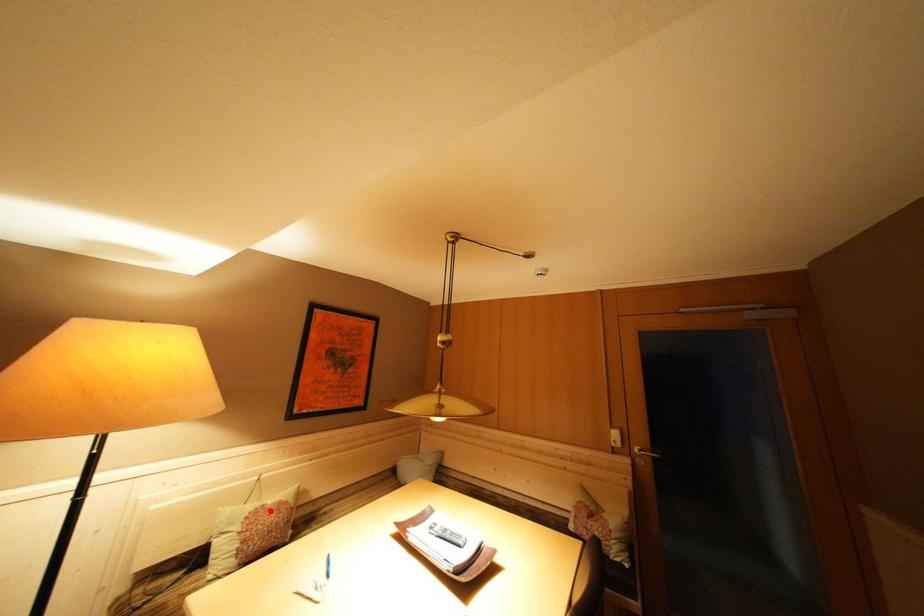
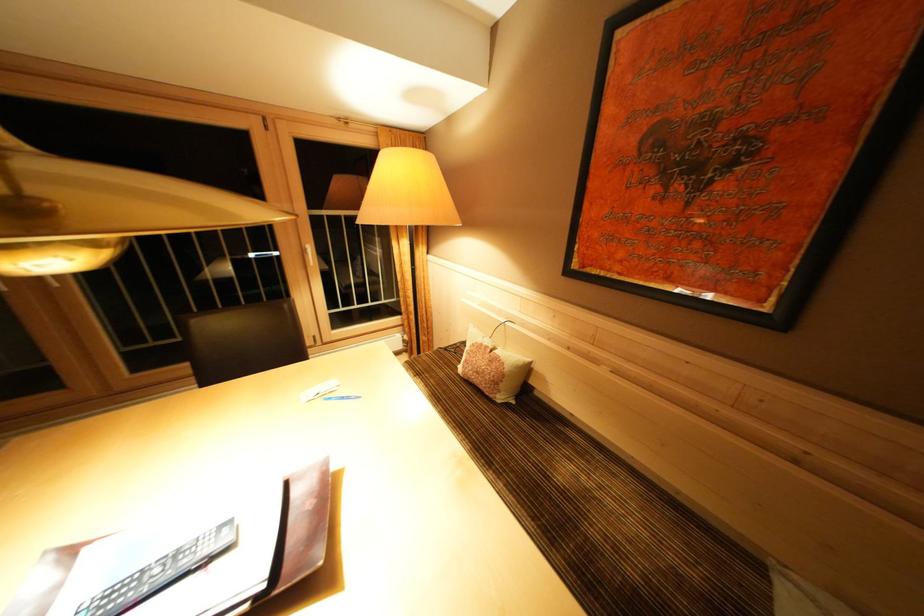
Find the pixel in the second image that matches the highlighted location in the first image.

(493, 352)